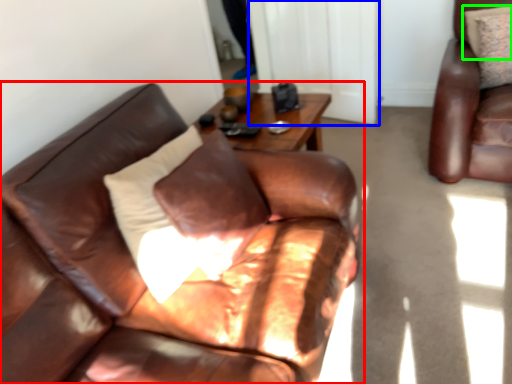
Question: Which is nearer to the studio couch (highlighted by a red box)? glass door (highlighted by a blue box) or pillow (highlighted by a green box).

Choices:
 (A) glass door
 (B) pillow

Answer: (A)